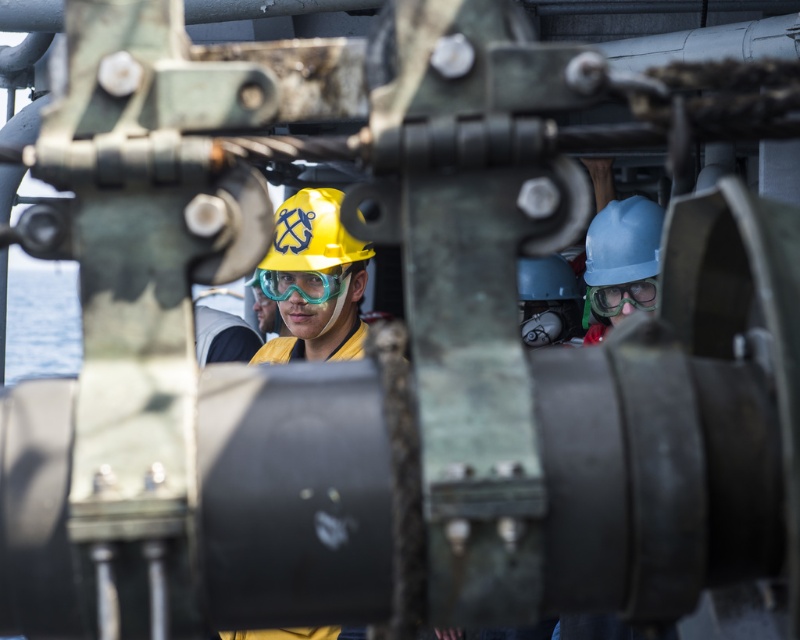
You are a safety inspector on the ship and need to check the distance between the yellow matte helmet at center and the camera. According to the safety regulations, the maximum allowable distance between safety equipment and the camera for monitoring is 25 feet. Is the current distance compliant?

The yellow matte helmet at center and camera are 23.94 feet apart, which is within the 25 feet maximum allowable distance, so it is compliant.

You are a safety inspector on the ship and need to check the visibility of the goggles. Which goggles are positioned higher, the translucent plastic goggles at center or the transparent plastic goggles at center?

The translucent plastic goggles at center is above transparent plastic goggles at center, so the translucent plastic goggles at center are positioned higher.

Based on the photo, you are a safety inspector on the ship and need to ensure all helmets meet size regulations. According to the scene, which helmet, the yellow matte helmet at center or the blue matte helmet at center, is compliant with the requirement that helmets must be no larger than 20 cm in diameter?

The blue matte helmet at center is compliant with the size requirement since it is smaller than the yellow matte helmet at center, which exceeds the 20 cm diameter limit.